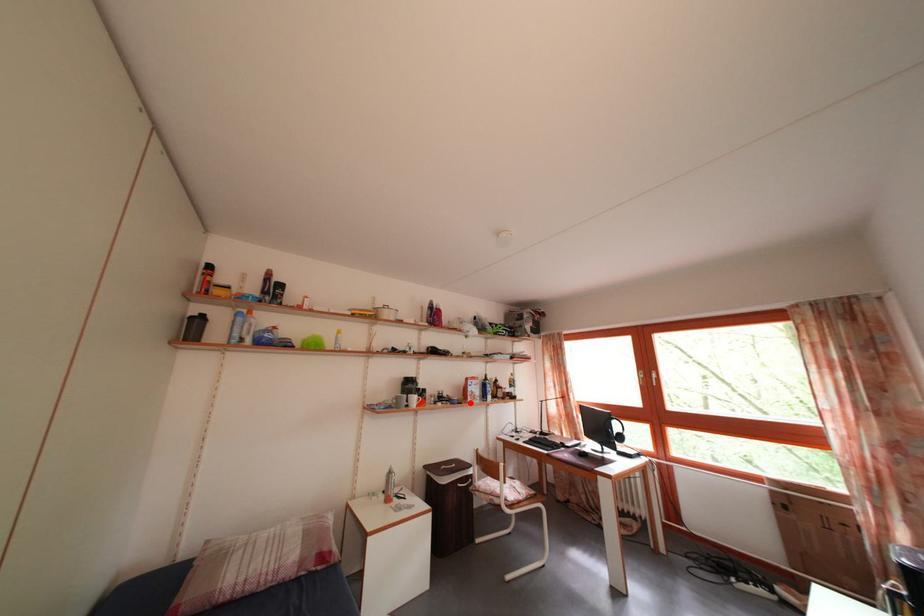
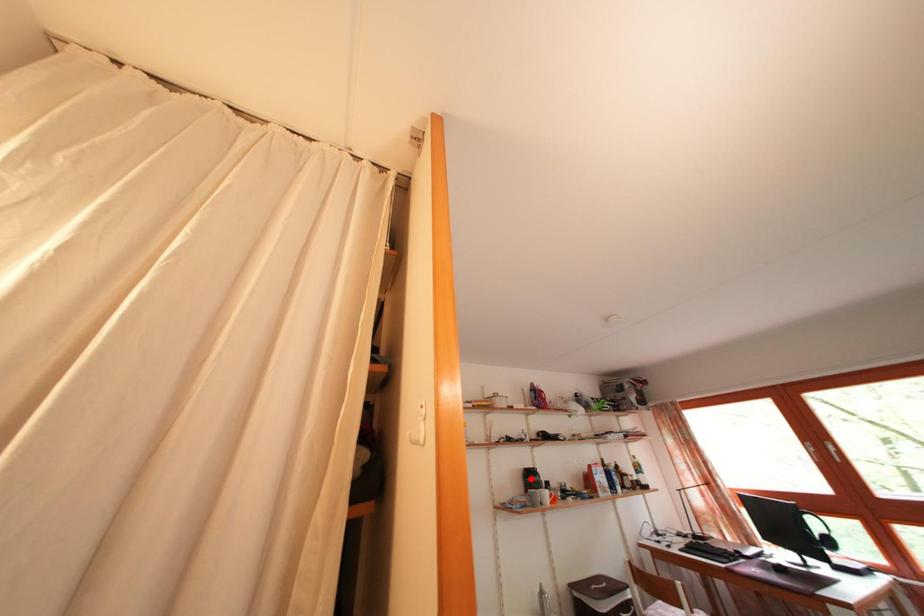
I am providing you with two images of the same scene from different viewpoints. A red point is marked on the first image and another point is marked on the second image. Is the red point in image1 aligned with the point shown in image2?

No